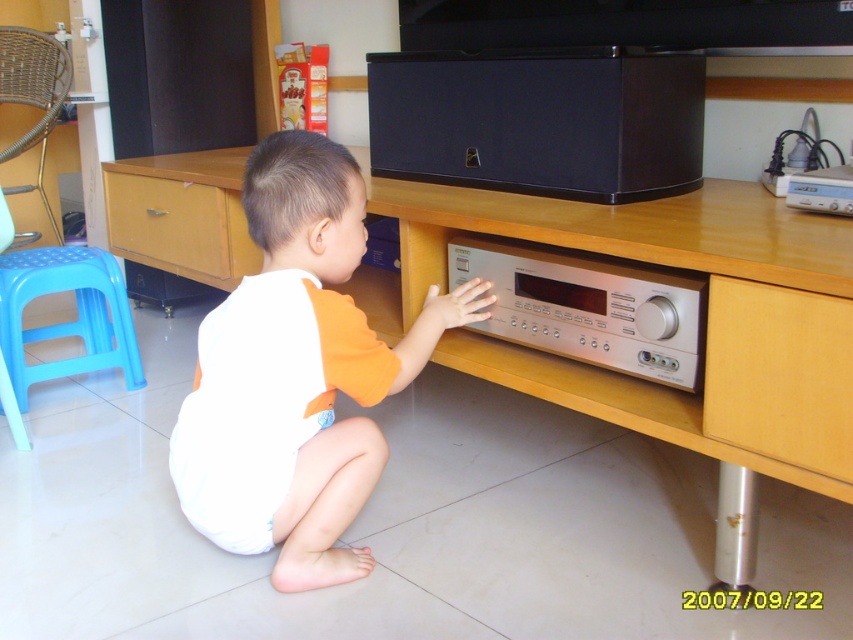
Question: Based on their relative distances, which object is nearer to the wooden drawer at lower left?

Choices:
 (A) blue plastic stool at left
 (B) wooden drawer at lower right
 (C) white cotton toddler at center

Answer: (A)

Question: Which of these objects is positioned farthest from the wooden drawer at lower left?

Choices:
 (A) blue plastic stool at left
 (B) white cotton toddler at center
 (C) wooden drawer at lower right

Answer: (C)

Question: Is wooden drawer at lower right positioned in front of blue plastic stool at left?

Choices:
 (A) no
 (B) yes

Answer: (B)

Question: Among these points, which one is farthest from the camera?

Choices:
 (A) (210, 198)
 (B) (82, 332)
 (C) (347, 492)

Answer: (B)

Question: Is wooden drawer at lower right closer to camera compared to blue plastic stool at left?

Choices:
 (A) yes
 (B) no

Answer: (A)

Question: Does white cotton toddler at center appear on the right side of wooden drawer at lower right?

Choices:
 (A) no
 (B) yes

Answer: (A)